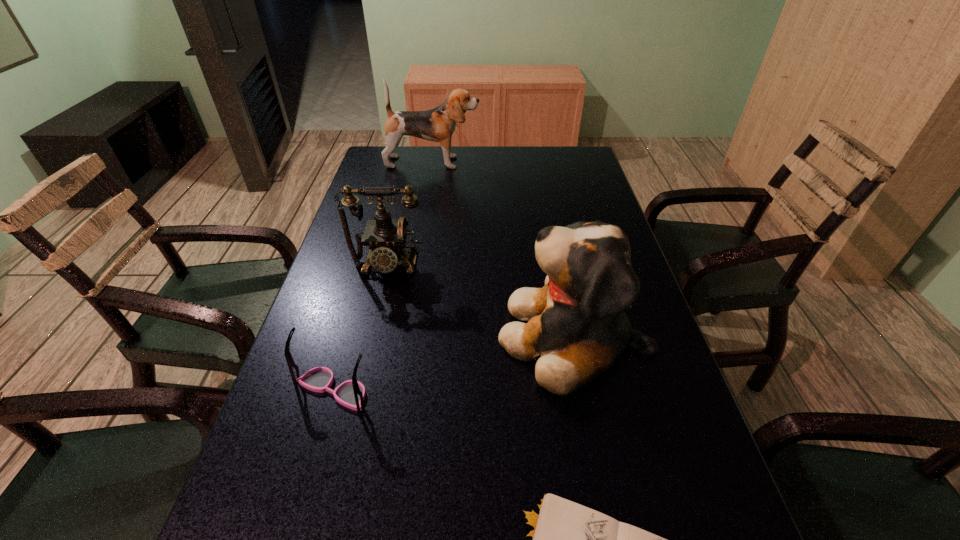
What are the coordinates of `free spot located on the rotary dial of the fourth nearest object` in the screenshot? It's located at (350, 418).

You are a GUI agent. You are given a task and a screenshot of the screen. Output one action in this format:
    pyautogui.click(x=<x>, y=<y>)
    Task: Click on the free spot located on the back of the fourth tallest object
    
    Given the screenshot: What is the action you would take?
    pyautogui.click(x=363, y=290)

I want to click on object at the far edge, so click(438, 124).

Image resolution: width=960 pixels, height=540 pixels. Identify the location of puppy located in the left edge section of the desktop. (438, 124).

This screenshot has width=960, height=540. In order to click on telephone that is at the left edge in this screenshot , I will do `click(386, 238)`.

Locate an element on the screen. The width and height of the screenshot is (960, 540). spectacles positioned at the left edge is located at coordinates (351, 393).

This screenshot has width=960, height=540. Identify the location of object that is at the right edge. (577, 329).

Where is `object located in the far left corner section of the desktop`? object located in the far left corner section of the desktop is located at coordinates (438, 124).

Where is `vacant space at the far edge of the desktop`? Image resolution: width=960 pixels, height=540 pixels. vacant space at the far edge of the desktop is located at coordinates (470, 171).

Where is `vacant space at the left edge`? The height and width of the screenshot is (540, 960). vacant space at the left edge is located at coordinates (364, 300).